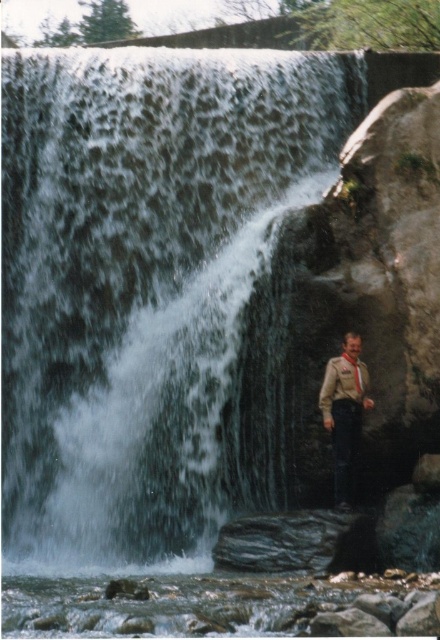
Question: Is clear water at center to the right of brown leather jacket at lower right from the viewer's perspective?

Choices:
 (A) yes
 (B) no

Answer: (B)

Question: From the image, what is the correct spatial relationship of brown leather jacket at lower right in relation to matte brown tie at right?

Choices:
 (A) left
 (B) right

Answer: (A)

Question: Is clear water at center closer to the viewer compared to brown leather jacket at lower right?

Choices:
 (A) no
 (B) yes

Answer: (A)

Question: Which is farther from the brown leather jacket at lower right?

Choices:
 (A) clear water at center
 (B) matte brown tie at right

Answer: (A)

Question: Which point appears closest to the camera in this image?

Choices:
 (A) (345, 432)
 (B) (135, 504)

Answer: (A)

Question: Among these objects, which one is nearest to the camera?

Choices:
 (A) clear water at center
 (B) matte brown tie at right

Answer: (B)